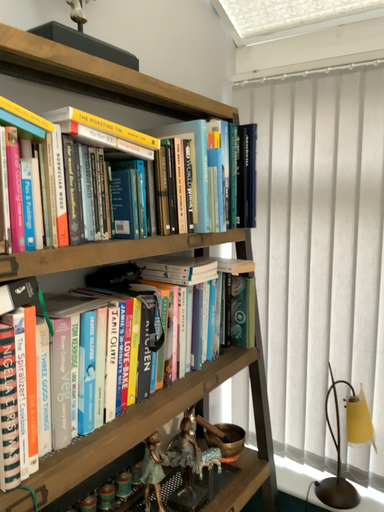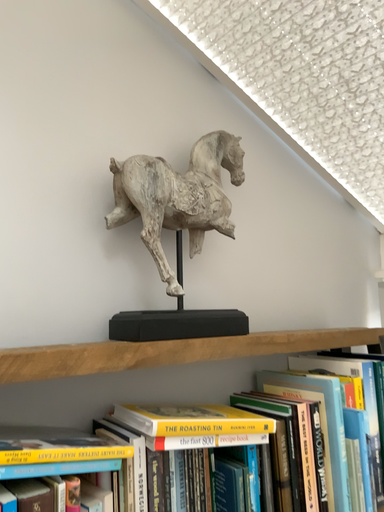
Question: Which way did the camera rotate in the video?

Choices:
 (A) rotated right
 (B) rotated left

Answer: (B)